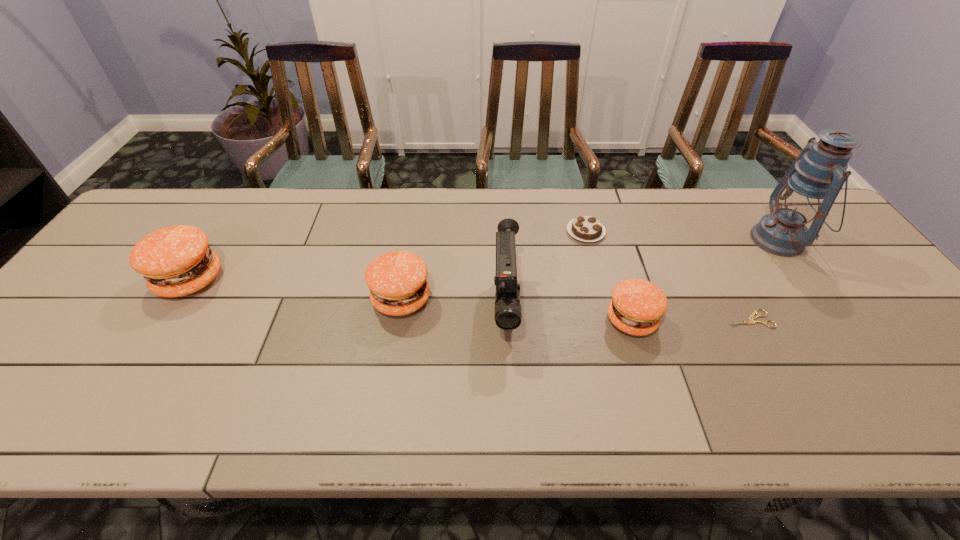
Locate an element on the screen. The height and width of the screenshot is (540, 960). patty object that ranks as the second closest to the sixth shortest object is located at coordinates (637, 305).

You are a GUI agent. You are given a task and a screenshot of the screen. Output one action in this format:
    pyautogui.click(x=<x>, y=<y>)
    Task: Click on the closest patty to the leftmost patty
    
    Given the screenshot: What is the action you would take?
    tap(397, 280)

You are a GUI agent. You are given a task and a screenshot of the screen. Output one action in this format:
    pyautogui.click(x=<x>, y=<y>)
    Task: Click on the blank area in the image that satisfies the following two spatial constraints: 1. on the front-facing side of the rightmost patty; 2. on the right side of the camcorder
    This screenshot has height=540, width=960.
    Given the screenshot: What is the action you would take?
    pyautogui.click(x=506, y=320)

The image size is (960, 540). Identify the location of blank space that satisfies the following two spatial constraints: 1. on the front side of the sixth object from right to left; 2. on the left side of the third shortest object. (397, 320).

Image resolution: width=960 pixels, height=540 pixels. Find the location of `vacant space that satisfies the following two spatial constraints: 1. on the front-facing side of the rightmost object; 2. on the front-facing side of the camcorder`. vacant space that satisfies the following two spatial constraints: 1. on the front-facing side of the rightmost object; 2. on the front-facing side of the camcorder is located at coordinates (827, 306).

At what (x,y) coordinates should I click in order to perform the action: click on free spot that satisfies the following two spatial constraints: 1. on the front-facing side of the camcorder; 2. on the left side of the sixth object from left to right. Please return your answer as a coordinate pair (x, y). Looking at the image, I should click on point(506,319).

This screenshot has width=960, height=540. Find the location of `free point that satisfies the following two spatial constraints: 1. on the front-facing side of the tallest object; 2. on the front side of the third shortest object`. free point that satisfies the following two spatial constraints: 1. on the front-facing side of the tallest object; 2. on the front side of the third shortest object is located at coordinates (836, 320).

Image resolution: width=960 pixels, height=540 pixels. Find the location of `vacant area in the image that satisfies the following two spatial constraints: 1. on the front-facing side of the sixth shortest object; 2. on the left side of the fifth tallest object`. vacant area in the image that satisfies the following two spatial constraints: 1. on the front-facing side of the sixth shortest object; 2. on the left side of the fifth tallest object is located at coordinates (506, 320).

You are a GUI agent. You are given a task and a screenshot of the screen. Output one action in this format:
    pyautogui.click(x=<x>, y=<y>)
    Task: Click on the vacant space that satisfies the following two spatial constraints: 1. on the front-facing side of the fifth tallest object; 2. on the left side of the sixth shortest object
    
    Given the screenshot: What is the action you would take?
    pyautogui.click(x=506, y=320)